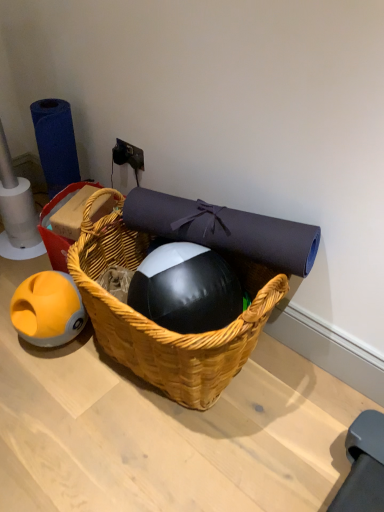
The height and width of the screenshot is (512, 384). I want to click on blue matte roll of toilet paper at left, so click(55, 143).

Is blue matte roll of toilet paper at left facing towards woven wood picnic basket at center?

Yes, blue matte roll of toilet paper at left is facing woven wood picnic basket at center.

Is blue matte roll of toilet paper at left directly adjacent to woven wood picnic basket at center?

No, blue matte roll of toilet paper at left is not in contact with woven wood picnic basket at center.

From the image's perspective, would you say blue matte roll of toilet paper at left is shown under woven wood picnic basket at center?

Incorrect, from the image's perspective, blue matte roll of toilet paper at left is higher than woven wood picnic basket at center.

Find the location of a particular element. The image size is (384, 512). toilet paper above the woven wood picnic basket at center (from a real-world perspective) is located at coordinates (55, 143).

Which of these two, woven wood basket at center or blue matte roll of toilet paper at left, is thinner?

With smaller width is blue matte roll of toilet paper at left.

Does woven wood basket at center have a greater height compared to blue matte roll of toilet paper at left?

In fact, woven wood basket at center may be shorter than blue matte roll of toilet paper at left.

Measure the distance from woven wood basket at center to woven wood picnic basket at center.

woven wood basket at center and woven wood picnic basket at center are 30.76 centimeters apart from each other.

Who is shorter, woven wood basket at center or woven wood picnic basket at center?

woven wood basket at center.

You are a GUI agent. You are given a task and a screenshot of the screen. Output one action in this format:
    pyautogui.click(x=<x>, y=<y>)
    Task: Click on the basket that is above the woven wood picnic basket at center (from a real-world perspective)
    
    Given the screenshot: What is the action you would take?
    pyautogui.click(x=64, y=222)

Does woven wood basket at center lie in front of woven wood picnic basket at center?

No, woven wood basket at center is further to the viewer.

Identify the location of picnic basket directly beneath the woven wood basket at center (from a real-world perspective). This screenshot has height=512, width=384. (162, 327).

Which is more to the left, woven wood picnic basket at center or woven wood basket at center?

From the viewer's perspective, woven wood basket at center appears more on the left side.

Is point (217, 336) closer to viewer compared to point (83, 206)?

Yes, it is in front of point (83, 206).

Considering the sizes of objects blue matte roll of toilet paper at left and woven wood basket at center in the image provided, who is taller, blue matte roll of toilet paper at left or woven wood basket at center?

blue matte roll of toilet paper at left.

Identify the location of toilet paper that is above the woven wood basket at center (from a real-world perspective). (55, 143).

Can you confirm if blue matte roll of toilet paper at left is bigger than woven wood basket at center?

Yes, blue matte roll of toilet paper at left is bigger than woven wood basket at center.

Measure the distance between blue matte roll of toilet paper at left and woven wood basket at center.

A distance of 8.84 inches exists between blue matte roll of toilet paper at left and woven wood basket at center.

Is woven wood picnic basket at center in contact with blue matte roll of toilet paper at left?

No, woven wood picnic basket at center is not in contact with blue matte roll of toilet paper at left.

Does point (90, 234) come farther from viewer compared to point (59, 157)?

No, it is not.

Is woven wood picnic basket at center smaller than blue matte roll of toilet paper at left?

No, woven wood picnic basket at center is not smaller than blue matte roll of toilet paper at left.

Based on their positions, is woven wood picnic basket at center located to the left or right of blue matte roll of toilet paper at left?

woven wood picnic basket at center is to the right of blue matte roll of toilet paper at left.

At what (x,y) coordinates should I click in order to perform the action: click on picnic basket located on the right of blue matte roll of toilet paper at left. Please return your answer as a coordinate pair (x, y). Image resolution: width=384 pixels, height=512 pixels. Looking at the image, I should click on (162, 327).

Where is `toilet paper lying on the left of woven wood basket at center`? The image size is (384, 512). toilet paper lying on the left of woven wood basket at center is located at coordinates (55, 143).

Estimate the real-world distances between objects in this image. Which object is further from blue matte roll of toilet paper at left, woven wood basket at center or woven wood picnic basket at center?

woven wood picnic basket at center lies further to blue matte roll of toilet paper at left than the other object.

When comparing their distances from woven wood picnic basket at center, does blue matte roll of toilet paper at left or woven wood basket at center seem further?

blue matte roll of toilet paper at left is further to woven wood picnic basket at center.

Which object lies nearer to the anchor point woven wood basket at center, blue matte roll of toilet paper at left or woven wood picnic basket at center?

The object closer to woven wood basket at center is blue matte roll of toilet paper at left.

Considering their positions, is woven wood picnic basket at center positioned closer to blue matte roll of toilet paper at left than woven wood basket at center?

woven wood basket at center lies closer to blue matte roll of toilet paper at left than the other object.

When comparing their distances from woven wood picnic basket at center, does woven wood basket at center or blue matte roll of toilet paper at left seem closer?

woven wood basket at center is positioned closer to the anchor woven wood picnic basket at center.

When comparing their distances from woven wood basket at center, does woven wood picnic basket at center or blue matte roll of toilet paper at left seem closer?

blue matte roll of toilet paper at left lies closer to woven wood basket at center than the other object.

Find the location of `basket between woven wood picnic basket at center and blue matte roll of toilet paper at left along the z-axis`. basket between woven wood picnic basket at center and blue matte roll of toilet paper at left along the z-axis is located at coordinates (64, 222).